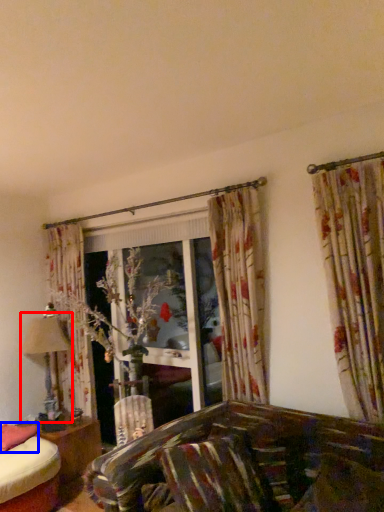
Question: Which point is further to the camera, table lamp (highlighted by a red box) or pillow (highlighted by a blue box)?

Choices:
 (A) table lamp
 (B) pillow

Answer: (A)